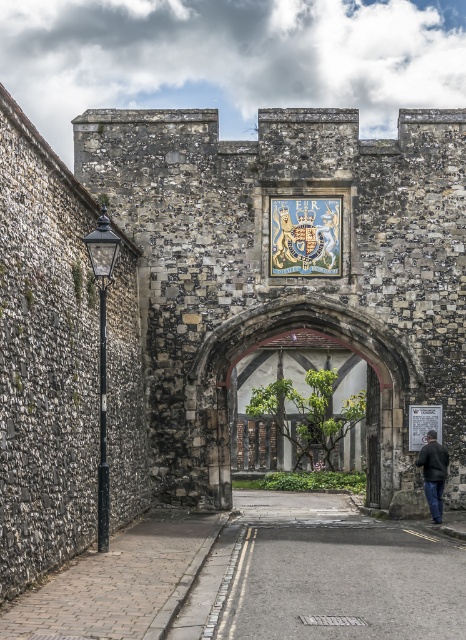
You are standing in front of the historic stone archway and notice a wooden object at center. Where exactly is the wooden at center located in terms of coordinates?

The wooden at center is located at coordinates point (372, 438).